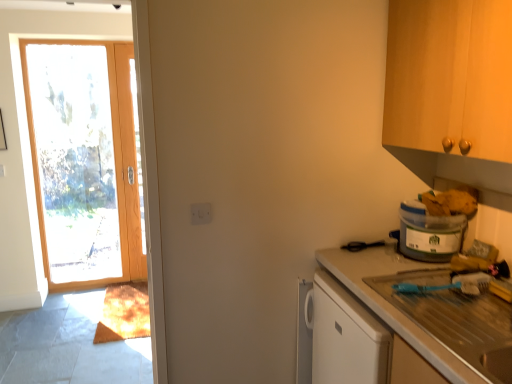
Find the location of a particular element. Image resolution: width=512 pixels, height=384 pixels. vacant point to the left of translucent plastic container at right is located at coordinates (375, 261).